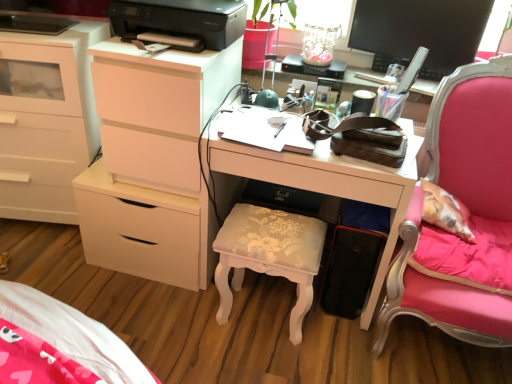
The width and height of the screenshot is (512, 384). Describe the element at coordinates (269, 255) in the screenshot. I see `white floral-patterned stool at center` at that location.

Image resolution: width=512 pixels, height=384 pixels. What do you see at coordinates (181, 20) in the screenshot? I see `black plastic printer at upper center` at bounding box center [181, 20].

What do you see at coordinates (329, 183) in the screenshot? I see `white glossy desk at center` at bounding box center [329, 183].

What do you see at coordinates (420, 32) in the screenshot? I see `black glossy monitor at upper right` at bounding box center [420, 32].

Image resolution: width=512 pixels, height=384 pixels. Identify the location of white floral-patterned stool at center. (269, 255).

Considering the sizes of objects white matte chest of drawers at left, marked as the second chest of drawers in a right-to-left arrangement, and white matte chest of drawers at left, the 2th chest of drawers viewed from the left, in the image provided, who is smaller, white matte chest of drawers at left, marked as the second chest of drawers in a right-to-left arrangement, or white matte chest of drawers at left, the 2th chest of drawers viewed from the left,?

white matte chest of drawers at left, the 2th chest of drawers viewed from the left.

The width and height of the screenshot is (512, 384). Find the location of `chest of drawers that appears on the left of white matte chest of drawers at left, the 2th chest of drawers viewed from the left`. chest of drawers that appears on the left of white matte chest of drawers at left, the 2th chest of drawers viewed from the left is located at coordinates pos(46,120).

How much distance is there between white matte chest of drawers at left, marked as the second chest of drawers in a right-to-left arrangement, and white matte chest of drawers at left, the 2th chest of drawers viewed from the left?

white matte chest of drawers at left, marked as the second chest of drawers in a right-to-left arrangement, and white matte chest of drawers at left, the 2th chest of drawers viewed from the left, are 15.55 inches apart.

Is white matte chest of drawers at left, the first chest of drawers in the left-to-right sequence, situated inside white matte chest of drawers at left, the 2th chest of drawers viewed from the left, or outside?

white matte chest of drawers at left, the first chest of drawers in the left-to-right sequence, is not inside white matte chest of drawers at left, the 2th chest of drawers viewed from the left, it's outside.

Considering the relative sizes of white matte chest of drawers at left, the first chest of drawers viewed from the right, and white floral-patterned stool at center in the image provided, is white matte chest of drawers at left, the first chest of drawers viewed from the right, thinner than white floral-patterned stool at center?

No, white matte chest of drawers at left, the first chest of drawers viewed from the right, is not thinner than white floral-patterned stool at center.

In the scene shown: What's the angular difference between white matte chest of drawers at left, the first chest of drawers viewed from the right, and white floral-patterned stool at center's facing directions?

The facing directions of white matte chest of drawers at left, the first chest of drawers viewed from the right, and white floral-patterned stool at center are 0.729 degrees apart.

Is white matte chest of drawers at left, the 2th chest of drawers viewed from the left, in contact with white floral-patterned stool at center?

white matte chest of drawers at left, the 2th chest of drawers viewed from the left, and white floral-patterned stool at center are not in contact.

Between white matte chest of drawers at left, the first chest of drawers viewed from the right, and white floral-patterned stool at center, which one has larger size?

white matte chest of drawers at left, the first chest of drawers viewed from the right.

This screenshot has width=512, height=384. In the image, there is a black glossy monitor at upper right. In order to click on desk below it (from the image's perspective) in this screenshot , I will do `click(329, 183)`.

Is white glossy desk at center wider or thinner than black glossy monitor at upper right?

white glossy desk at center is wider than black glossy monitor at upper right.

In the image, is white glossy desk at center positioned in front of or behind black glossy monitor at upper right?

white glossy desk at center is positioned closer to the viewer than black glossy monitor at upper right.

Is white glossy desk at center looking in the opposite direction of black glossy monitor at upper right?

white glossy desk at center does not have its back to black glossy monitor at upper right.

How different are the orientations of white floral-patterned stool at center and pink fabric chair at right in degrees?

There is a 2.3-degree angle between the facing directions of white floral-patterned stool at center and pink fabric chair at right.

Does white floral-patterned stool at center have a lesser width compared to pink fabric chair at right?

Correct, the width of white floral-patterned stool at center is less than that of pink fabric chair at right.

Considering the positions of points (283, 251) and (459, 184), is point (283, 251) farther from camera compared to point (459, 184)?

That is False.

Considering the relative positions of white floral-patterned stool at center and white glossy desk at center in the image provided, is white floral-patterned stool at center to the left of white glossy desk at center from the viewer's perspective?

Indeed, white floral-patterned stool at center is positioned on the left side of white glossy desk at center.

From the image's perspective, is white floral-patterned stool at center above or below white glossy desk at center?

white floral-patterned stool at center is below white glossy desk at center.

Is white floral-patterned stool at center beside white glossy desk at center?

There is a gap between white floral-patterned stool at center and white glossy desk at center.

Which point is more distant from viewer, (280, 230) or (102, 263)?

The point (102, 263) is farther from the camera.

From the image's perspective, is white glossy desk at center beneath white matte chest of drawers at left, the 2th chest of drawers viewed from the left?

Answer: Yes, from the image's perspective, white glossy desk at center is beneath white matte chest of drawers at left, the 2th chest of drawers viewed from the left.

Is white glossy desk at center oriented away from white matte chest of drawers at left, the 2th chest of drawers viewed from the left?

That's not correct — white glossy desk at center is not looking away from white matte chest of drawers at left, the 2th chest of drawers viewed from the left.

Can you confirm if white glossy desk at center is positioned to the right of white matte chest of drawers at left, the 2th chest of drawers viewed from the left?

Yes.

Could you measure the distance between white glossy desk at center and white matte chest of drawers at left, the 2th chest of drawers viewed from the left?

They are 5.85 inches apart.

Would you consider pink fabric chair at right to be distant from white matte chest of drawers at left, the first chest of drawers viewed from the right?

No, pink fabric chair at right is not far away from white matte chest of drawers at left, the first chest of drawers viewed from the right.

Considering the relative sizes of pink fabric chair at right and white matte chest of drawers at left, the 2th chest of drawers viewed from the left, in the image provided, is pink fabric chair at right shorter than white matte chest of drawers at left, the 2th chest of drawers viewed from the left,?

No.

Which object is further away from the camera, pink fabric chair at right or white matte chest of drawers at left, the 2th chest of drawers viewed from the left?

white matte chest of drawers at left, the 2th chest of drawers viewed from the left.

From the image's perspective, would you say pink fabric chair at right is positioned over white matte chest of drawers at left, the first chest of drawers viewed from the right?

Incorrect, from the image's perspective, pink fabric chair at right is lower than white matte chest of drawers at left, the first chest of drawers viewed from the right.

I want to click on chest of drawers behind the white matte chest of drawers at left, the first chest of drawers in the left-to-right sequence, so click(x=152, y=160).

The image size is (512, 384). What are the coordinates of `stool to the right of white matte chest of drawers at left, the first chest of drawers viewed from the right` in the screenshot? It's located at (269, 255).

Which object lies nearer to the anchor point black glossy monitor at upper right, white glossy desk at center or white matte chest of drawers at left, the 2th chest of drawers viewed from the left?

white glossy desk at center is closer to black glossy monitor at upper right.

When comparing their distances from white floral-patterned stool at center, does black glossy monitor at upper right or white glossy desk at center seem closer?

white glossy desk at center.

When comparing their distances from white floral-patterned stool at center, does white glossy desk at center or white matte chest of drawers at left, the 2th chest of drawers viewed from the left, seem closer?

white glossy desk at center is positioned closer to the anchor white floral-patterned stool at center.

Looking at the image, which one is located further to white glossy desk at center, black glossy monitor at upper right or white floral-patterned stool at center?

black glossy monitor at upper right is positioned further to the anchor white glossy desk at center.

Which object lies further to the anchor point white matte chest of drawers at left, the 2th chest of drawers viewed from the left, white matte chest of drawers at left, marked as the second chest of drawers in a right-to-left arrangement, or white glossy desk at center?

white matte chest of drawers at left, marked as the second chest of drawers in a right-to-left arrangement.

Which object lies nearer to the anchor point black glossy monitor at upper right, white glossy desk at center or white floral-patterned stool at center?

white glossy desk at center.

Based on their spatial positions, is pink fabric chair at right or black glossy monitor at upper right closer to white matte chest of drawers at left, the 2th chest of drawers viewed from the left?

pink fabric chair at right.

Based on their spatial positions, is white matte chest of drawers at left, the 2th chest of drawers viewed from the left, or black plastic printer at upper center closer to white floral-patterned stool at center?

white matte chest of drawers at left, the 2th chest of drawers viewed from the left, lies closer to white floral-patterned stool at center than the other object.

In order to click on desk located between white matte chest of drawers at left, the first chest of drawers viewed from the right, and black glossy monitor at upper right in the left-right direction in this screenshot , I will do `click(329, 183)`.

Where is `computer monitor between white matte chest of drawers at left, the first chest of drawers in the left-to-right sequence, and pink fabric chair at right from left to right`? This screenshot has height=384, width=512. computer monitor between white matte chest of drawers at left, the first chest of drawers in the left-to-right sequence, and pink fabric chair at right from left to right is located at coordinates (420, 32).

Identify the location of computer monitor between white matte chest of drawers at left, the first chest of drawers viewed from the right, and pink fabric chair at right, in the horizontal direction. (420, 32).

Identify the location of chest of drawers between white matte chest of drawers at left, the first chest of drawers in the left-to-right sequence, and white glossy desk at center, in the horizontal direction. The width and height of the screenshot is (512, 384). (152, 160).